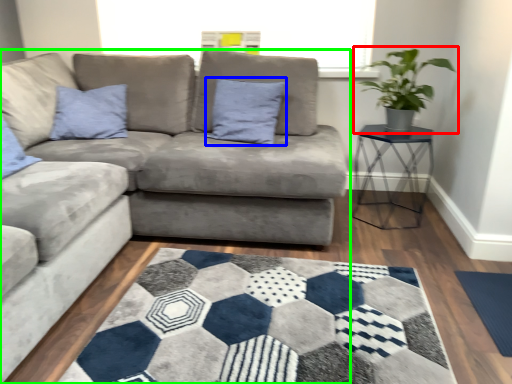
Question: Which is farther away from houseplant (highlighted by a red box)? pillow (highlighted by a blue box) or studio couch (highlighted by a green box)?

Choices:
 (A) pillow
 (B) studio couch

Answer: (B)